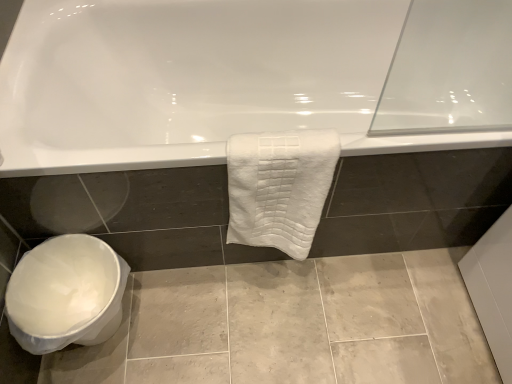
Question: From a real-world perspective, is white glossy bathtub at upper center physically located above or below white textured towel at center?

Choices:
 (A) below
 (B) above

Answer: (A)

Question: Considering the positions of point (92, 109) and point (233, 203), is point (92, 109) closer or farther from the camera than point (233, 203)?

Choices:
 (A) farther
 (B) closer

Answer: (A)

Question: Based on their relative distances, which object is farther from the white plastic toilet bowl at lower left?

Choices:
 (A) gray marble tile at lower left
 (B) white glossy bathtub at upper center
 (C) white textured towel at center

Answer: (B)

Question: Estimate the real-world distances between objects in this image. Which object is farther from the white glossy bathtub at upper center?

Choices:
 (A) white textured towel at center
 (B) white plastic toilet bowl at lower left
 (C) gray marble tile at lower left

Answer: (C)